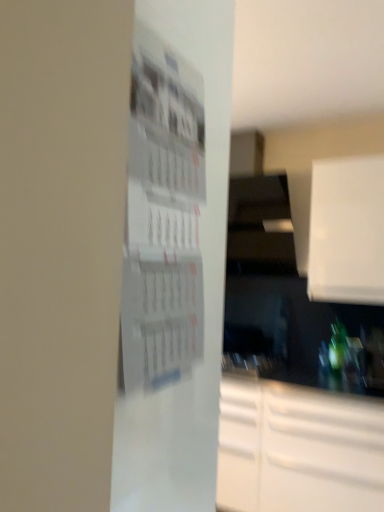
Image resolution: width=384 pixels, height=512 pixels. What do you see at coordinates (162, 215) in the screenshot?
I see `white paper at center` at bounding box center [162, 215].

This screenshot has width=384, height=512. What are the coordinates of `white paper at center` in the screenshot? It's located at (162, 215).

Find the location of a particular element. The image size is (384, 512). green glass bottle at lower right is located at coordinates (337, 352).

Between white paper at center and green glass bottle at lower right, which one has smaller width?

white paper at center is thinner.

Which is more to the right, white paper at center or green glass bottle at lower right?

Positioned to the right is green glass bottle at lower right.

Considering the sizes of objects white paper at center and green glass bottle at lower right in the image provided, who is bigger, white paper at center or green glass bottle at lower right?

With larger size is white paper at center.

From their relative heights in the image, would you say white paper at center is taller or shorter than green glass bottle at lower right?

Considering their sizes, white paper at center has more height than green glass bottle at lower right.

Does white matte cabinet at upper right turn towards white paper at center?

Yes, white matte cabinet at upper right is oriented towards white paper at center.

I want to click on bulletin board lying below the white matte cabinet at upper right (from the image's perspective), so click(x=162, y=215).

Consider the image. From a real-world perspective, is white matte cabinet at upper right positioned over white paper at center based on gravity?

Yes, from a real-world perspective, white matte cabinet at upper right is over white paper at center

Considering the positions of objects white matte cabinet at upper right and white paper at center in the image provided, who is more to the right, white matte cabinet at upper right or white paper at center?

white matte cabinet at upper right.

Is point (189, 192) closer or farther from the camera than point (337, 258)?

Point (189, 192) is closer to the camera than point (337, 258).

Looking at the image, does white paper at center seem bigger or smaller compared to white matte cabinet at upper right?

In the image, white paper at center appears to be smaller than white matte cabinet at upper right.

You are a GUI agent. You are given a task and a screenshot of the screen. Output one action in this format:
    pyautogui.click(x=<x>, y=<y>)
    Task: Click on the bulletin board that appears on the left of white matte cabinet at upper right
    
    Given the screenshot: What is the action you would take?
    pyautogui.click(x=162, y=215)

From the picture: Between green glass bottle at lower right and white matte cabinet at upper right, which one has larger width?

Wider between the two is white matte cabinet at upper right.

From the picture: How much distance is there between green glass bottle at lower right and white matte cabinet at upper right?

They are 69.01 centimeters apart.

Is green glass bottle at lower right in contact with white matte cabinet at upper right?

No, green glass bottle at lower right is not touching white matte cabinet at upper right.

From the image's perspective, is green glass bottle at lower right above or below white matte cabinet at upper right?

Clearly, from the image's perspective, green glass bottle at lower right is below white matte cabinet at upper right.

At what (x,y) coordinates should I click in order to perform the action: click on cabinetry lying above the green glass bottle at lower right (from the image's perspective). Please return your answer as a coordinate pair (x, y). The height and width of the screenshot is (512, 384). Looking at the image, I should click on (347, 231).

Measure the distance between white matte cabinet at upper right and green glass bottle at lower right.

white matte cabinet at upper right is 27.17 inches from green glass bottle at lower right.

Is white matte cabinet at upper right looking in the opposite direction of green glass bottle at lower right?

No.

From the picture: Is white paper at center at the back of green glass bottle at lower right?

No.

Considering the relative positions of green glass bottle at lower right and white paper at center in the image provided, is green glass bottle at lower right to the left or to the right of white paper at center?

green glass bottle at lower right is to the right of white paper at center.

Is green glass bottle at lower right outside of white paper at center?

green glass bottle at lower right lies outside white paper at center's area.

You are a GUI agent. You are given a task and a screenshot of the screen. Output one action in this format:
    pyautogui.click(x=<x>, y=<y>)
    Task: Click on the bottle below the white paper at center (from the image's perspective)
    The image size is (384, 512).
    Given the screenshot: What is the action you would take?
    pyautogui.click(x=337, y=352)

Image resolution: width=384 pixels, height=512 pixels. I want to click on bulletin board below the white matte cabinet at upper right (from a real-world perspective), so click(x=162, y=215).

Which object lies nearer to the anchor point white matte cabinet at upper right, green glass bottle at lower right or white paper at center?

green glass bottle at lower right is closer to white matte cabinet at upper right.

Estimate the real-world distances between objects in this image. Which object is further from green glass bottle at lower right, white paper at center or white matte cabinet at upper right?

Among the two, white paper at center is located further to green glass bottle at lower right.

When comparing their distances from white matte cabinet at upper right, does white paper at center or green glass bottle at lower right seem closer?

green glass bottle at lower right.

Looking at the image, which one is located closer to white paper at center, white matte cabinet at upper right or green glass bottle at lower right?

Among the two, white matte cabinet at upper right is located nearer to white paper at center.

Considering their positions, is green glass bottle at lower right positioned closer to white paper at center than white matte cabinet at upper right?

The object closer to white paper at center is white matte cabinet at upper right.

When comparing their distances from green glass bottle at lower right, does white matte cabinet at upper right or white paper at center seem further?

white paper at center lies further to green glass bottle at lower right than the other object.

Identify the location of cabinetry between white paper at center and green glass bottle at lower right along the z-axis. The image size is (384, 512). (347, 231).